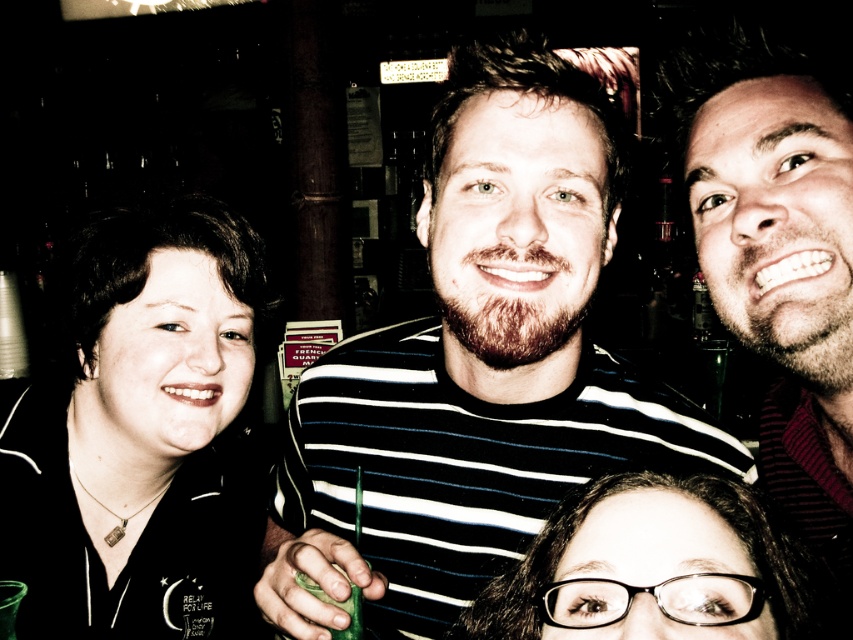
How much distance is there between striped shirt at center and bearded man at center?

A distance of 8.72 inches exists between striped shirt at center and bearded man at center.

Find the location of a particular element. This screenshot has width=853, height=640. striped shirt at center is located at coordinates (477, 365).

I want to click on striped shirt at center, so click(x=477, y=365).

Between point (514, 385) and point (579, 560), which one is positioned in front?

Point (579, 560)

Who is taller, striped shirt at center or clear plastic glasses at lower center?

With more height is striped shirt at center.

Is point (401, 525) farther from viewer compared to point (611, 484)?

That is True.

Where is `striped shirt at center`? striped shirt at center is located at coordinates (477, 365).

Is striped shirt at center further to the viewer compared to green matte glass at lower center?

No, striped shirt at center is in front of green matte glass at lower center.

Is striped shirt at center to the left of green matte glass at lower center from the viewer's perspective?

Incorrect, striped shirt at center is not on the left side of green matte glass at lower center.

Find the location of a particular element. Image resolution: width=853 pixels, height=640 pixels. striped shirt at center is located at coordinates (477, 365).

Locate an element on the screen. The height and width of the screenshot is (640, 853). striped shirt at center is located at coordinates (477, 365).